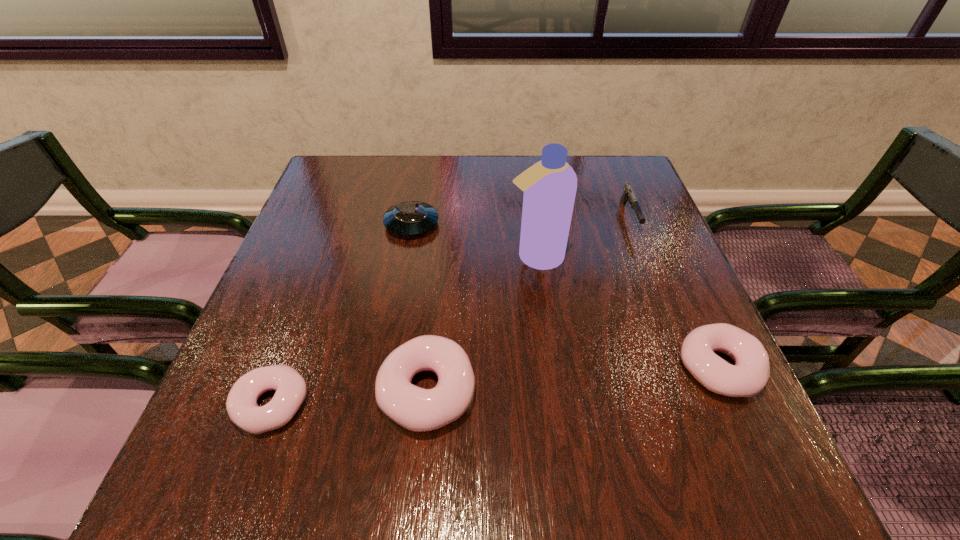
I want to click on object that is at the near right corner, so (748, 376).

In the image, there is a desktop. Identify the location of vacant space at the far edge. The image size is (960, 540). (503, 159).

The width and height of the screenshot is (960, 540). What are the coordinates of `free space at the near edge of the desktop` in the screenshot? It's located at (549, 385).

Find the location of a particular element. The width and height of the screenshot is (960, 540). vacant region at the left edge of the desktop is located at coordinates (319, 269).

What are the coordinates of `blank space at the far left corner of the desktop` in the screenshot? It's located at (328, 201).

The image size is (960, 540). Identify the location of blank space at the far right corner. (587, 173).

Identify the location of vacant space that is in between the leftmost doughnut and the second doughnut from left to right. point(349,398).

Find the location of a particular element. vacant space in between the saucer and the leftmost object is located at coordinates (342, 314).

I want to click on free space between the second shortest doughnut and the saucer, so click(564, 296).

Locate an element on the screen. This screenshot has height=540, width=960. free space between the saucer and the leftmost doughnut is located at coordinates (342, 314).